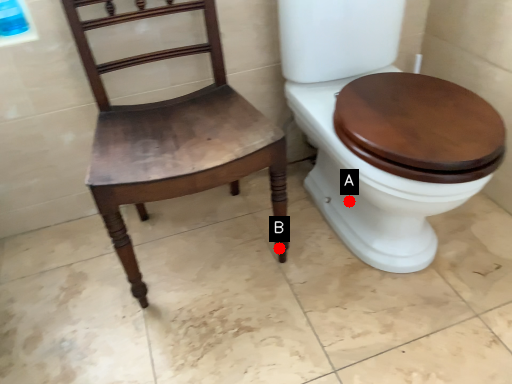
Question: Two points are circled on the image, labeled by A and B beside each circle. Which point appears closest to the camera in this image?

Choices:
 (A) A is closer
 (B) B is closer

Answer: (B)